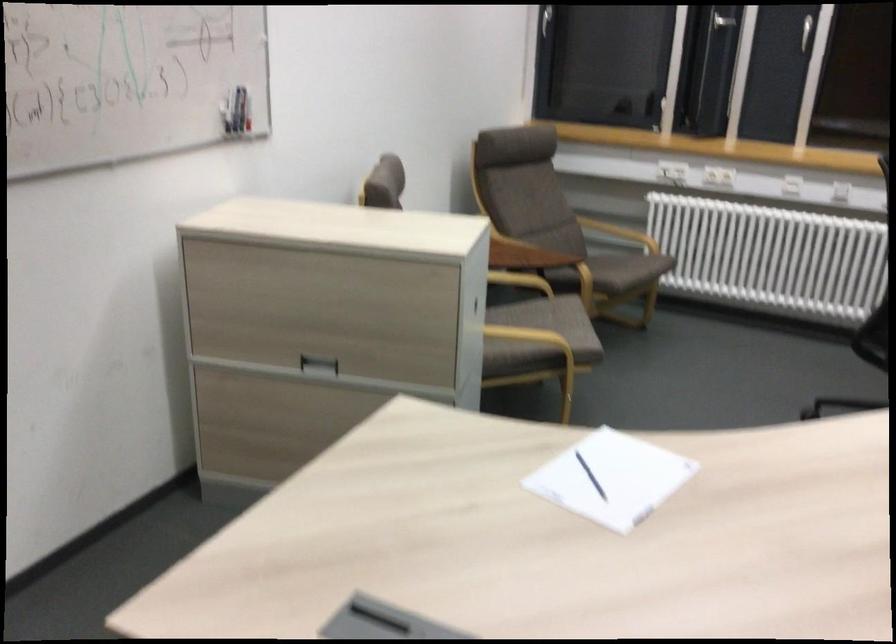
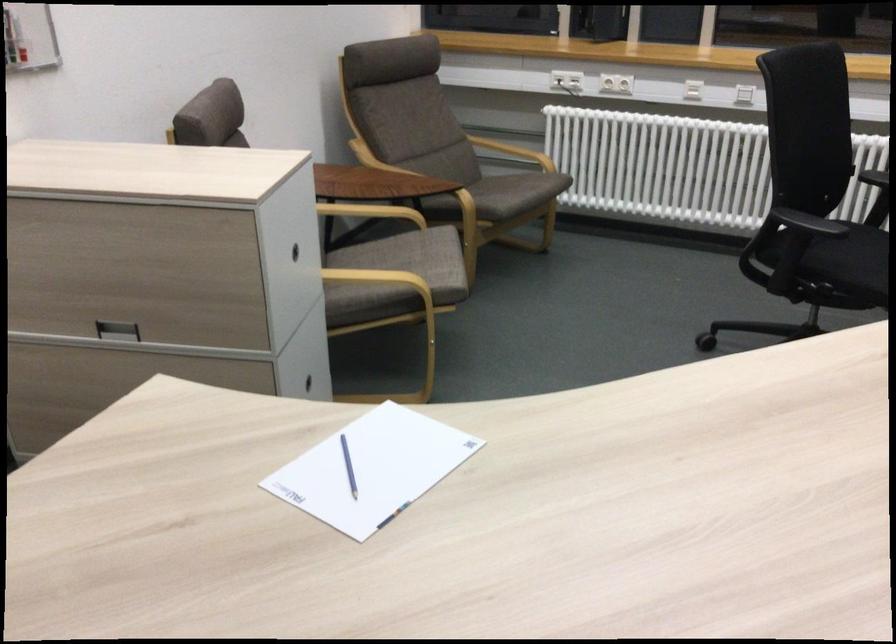
Locate, in the second image, the point that corresponds to (728,174) in the first image.

(616, 82)